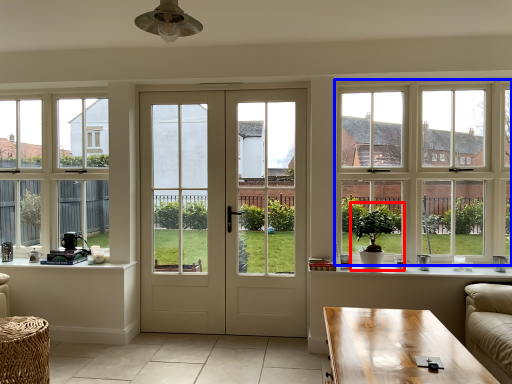
Question: Which point is further to the camera, houseplant (highlighted by a red box) or window (highlighted by a blue box)?

Choices:
 (A) houseplant
 (B) window

Answer: (B)